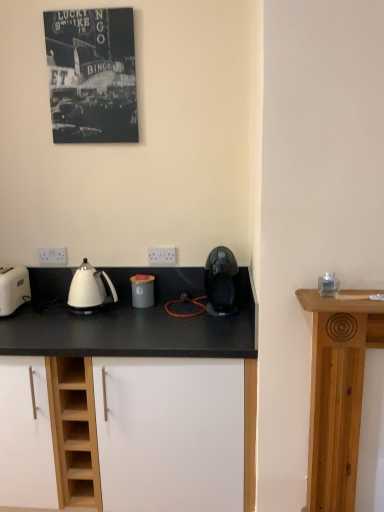
Identify the location of free space between white plastic electric outlet at center, the second electric outlet from the back, and white plastic electric outlet at lower left, the first electric outlet positioned from the left. (112, 264).